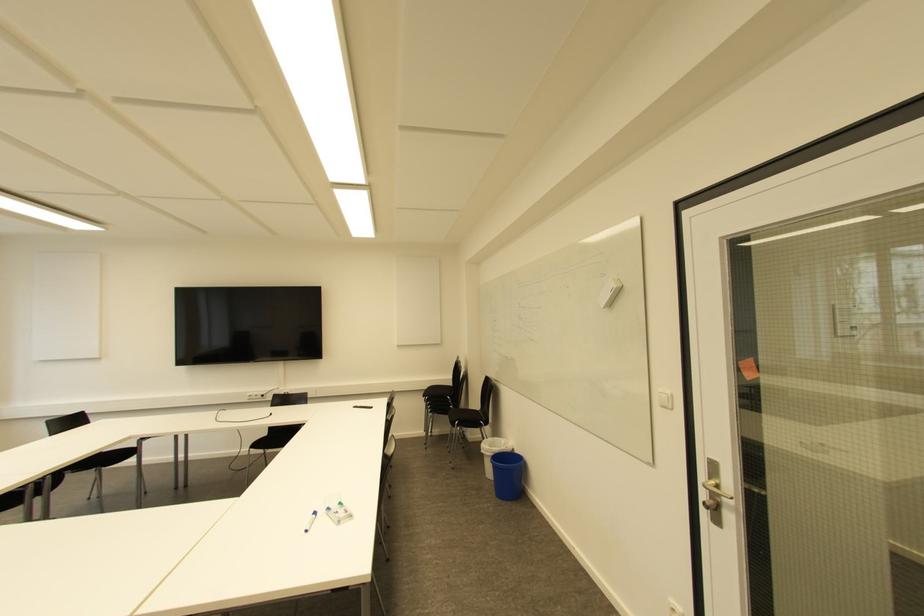
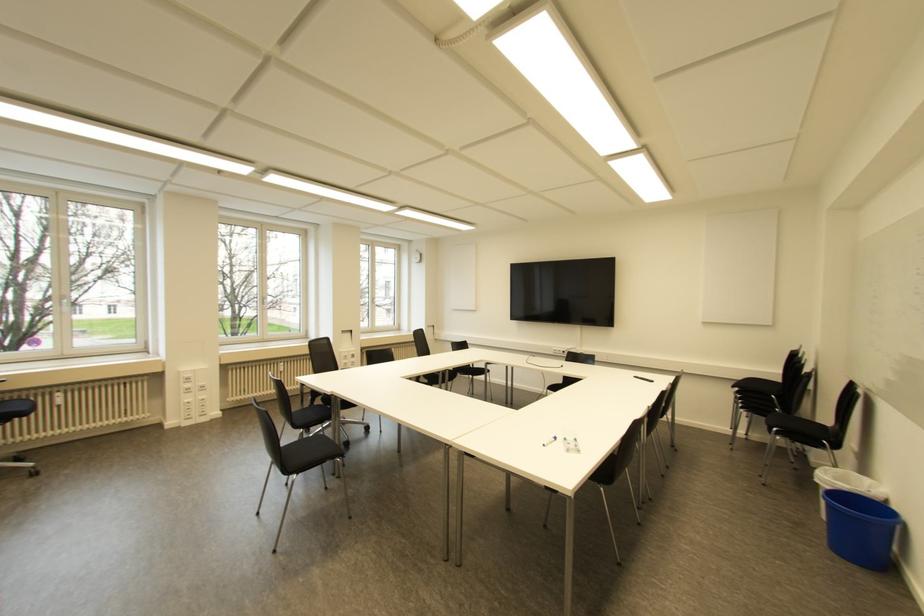
Question: The images are taken continuously from a first-person perspective. In which direction is your viewpoint rotating?

Choices:
 (A) Left
 (B) Right
 (C) Up
 (D) Down

Answer: (A)